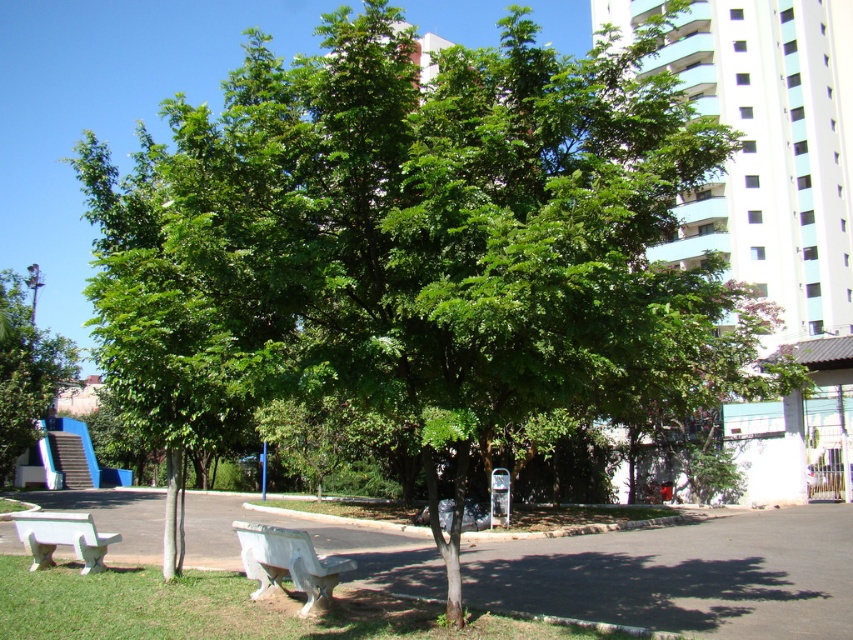
Is green leafy tree at left to the left of white concrete bench at lower center from the viewer's perspective?

Indeed, green leafy tree at left is positioned on the left side of white concrete bench at lower center.

Find the location of a particular element. This screenshot has width=853, height=640. green leafy tree at left is located at coordinates (25, 371).

Find the location of a particular element. The width and height of the screenshot is (853, 640). green leafy tree at left is located at coordinates (25, 371).

Looking at this image, which is more to the left, white concrete bench at lower center or white plastic bench at lower left?

white plastic bench at lower left

Which is more to the right, white concrete bench at lower center or white plastic bench at lower left?

white concrete bench at lower center

Is point (322, 609) positioned before point (78, 534)?

Yes, it is.

Find the location of `white concrete bench at lower center`. white concrete bench at lower center is located at coordinates (288, 563).

This screenshot has height=640, width=853. What do you see at coordinates (25, 371) in the screenshot?
I see `green leafy tree at left` at bounding box center [25, 371].

Between green leafy tree at left and white plastic bench at lower left, which one is positioned higher?

Positioned higher is green leafy tree at left.

Is point (10, 472) more distant than point (47, 525)?

Yes, point (10, 472) is behind point (47, 525).

You are a GUI agent. You are given a task and a screenshot of the screen. Output one action in this format:
    pyautogui.click(x=<x>, y=<y>)
    Task: Click on the green leafy tree at left
    The height and width of the screenshot is (640, 853).
    Given the screenshot: What is the action you would take?
    pyautogui.click(x=25, y=371)